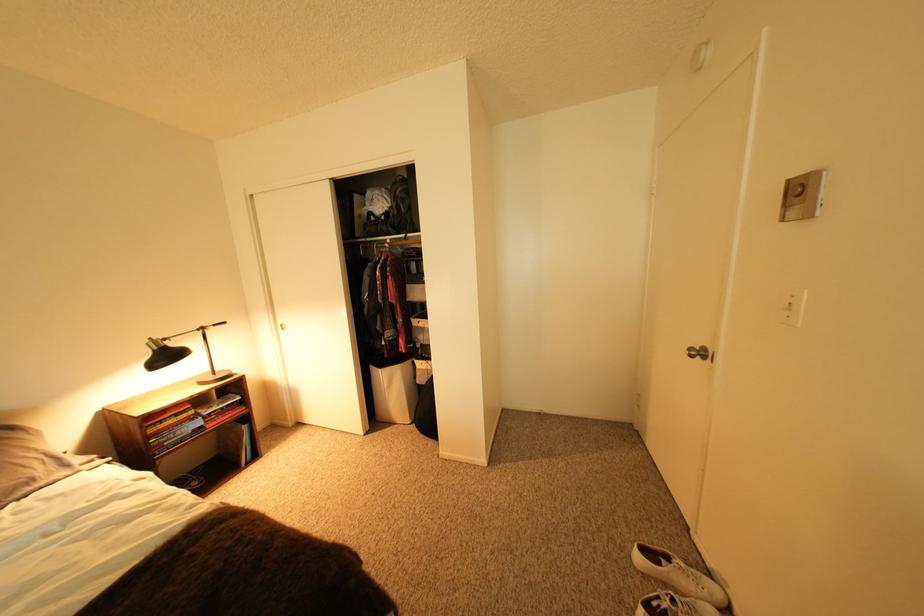
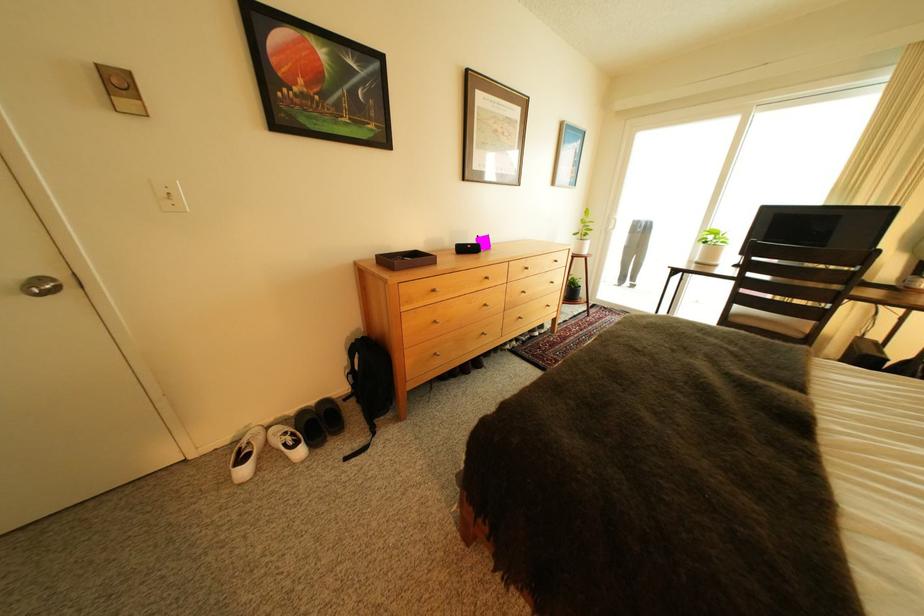
Locate, in the second image, the point that corresponds to (716,351) in the first image.

(55, 281)